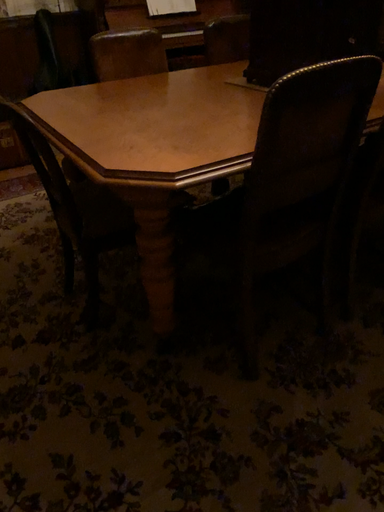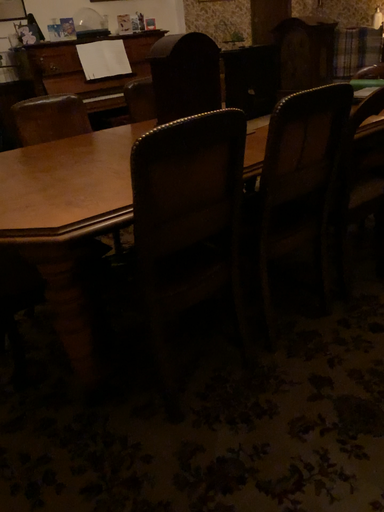
Question: How did the camera likely rotate when shooting the video?

Choices:
 (A) rotated downward
 (B) rotated upward

Answer: (B)